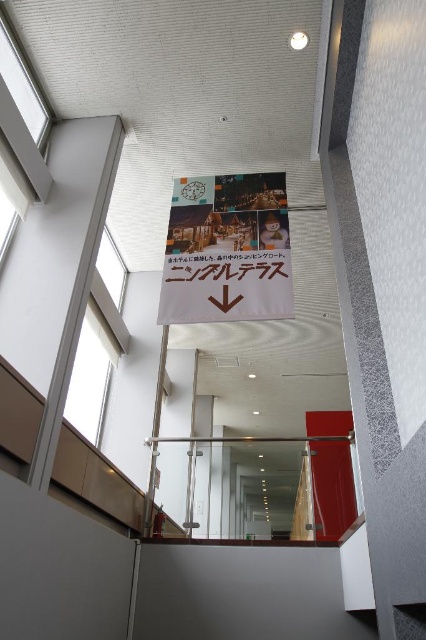
You are standing in the corridor and want to hang a new decoration. The matte paper poster at center is currently displayed. If you want to replace it with a larger one that is twice as tall as the transparent glass window at upper left, will there be enough space vertically?

The matte paper poster at center has a lesser height compared to transparent glass window at upper left. Since the new poster would be twice the height of the window, it would exceed the current poster height, so there might not be enough vertical space unless the area allows for taller displays.